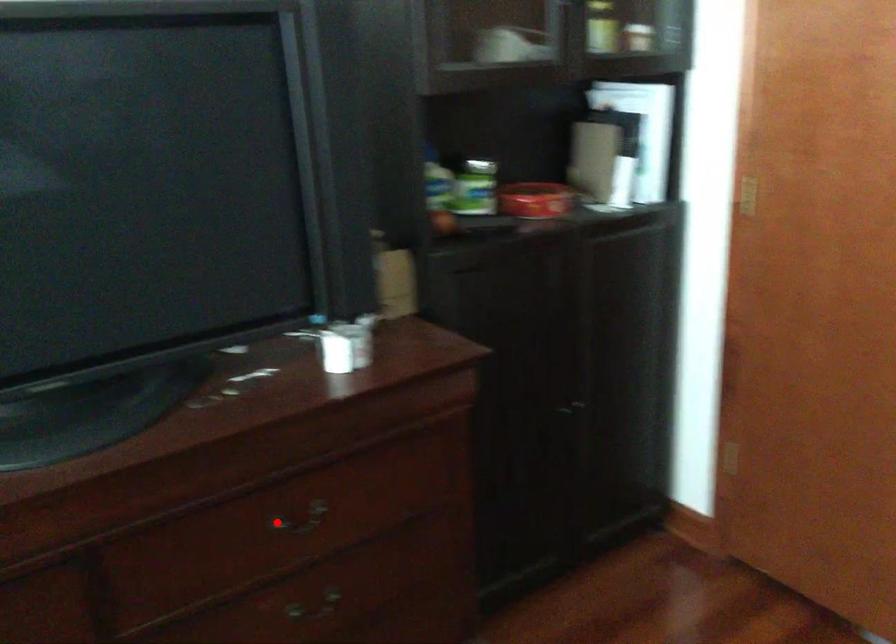
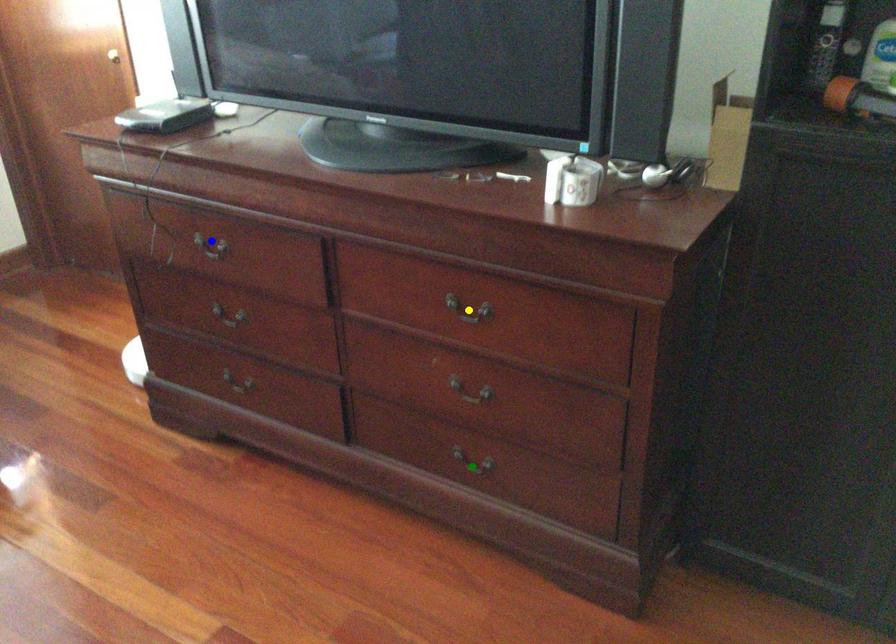
Question: I am providing you with two images of the same scene from different viewpoints. A red point is marked on the first image. You are given multiple points on the second image. Which point in image 2 is actually the same real-world point as the red point in image 1?

Choices:
 (A) yellow point
 (B) blue point
 (C) green point

Answer: (A)